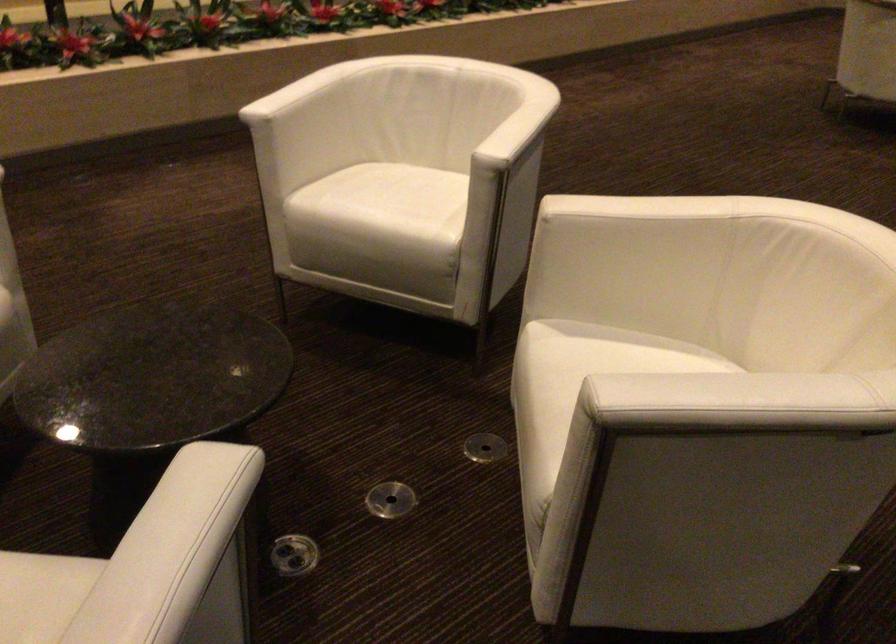
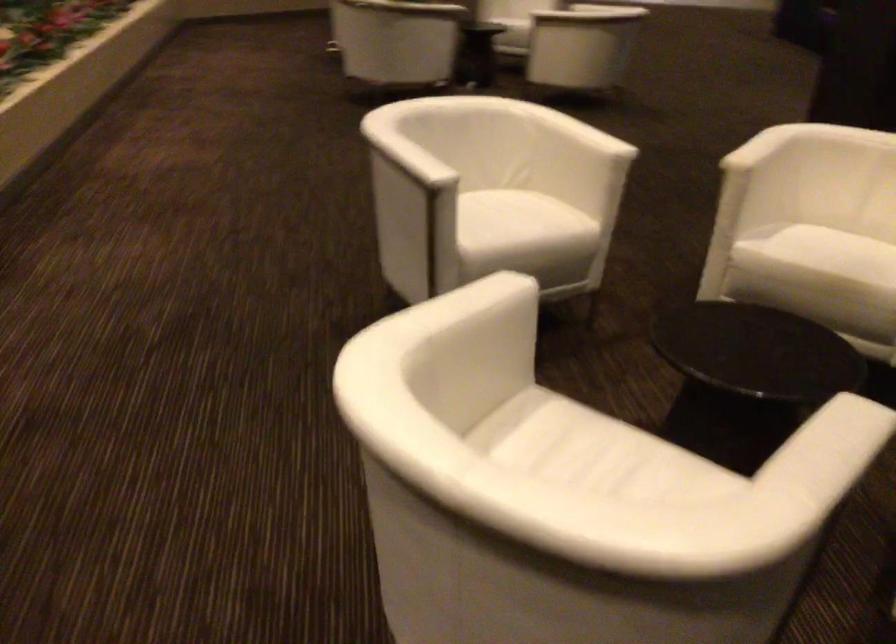
Question: I am providing you with two images of the same scene from different viewpoints. Please identify which objects are invisible in image2.

Choices:
 (A) white chair armrest
 (B) yellow control knob
 (C) white chair sitting surface
 (D) round floor cover

Answer: (D)